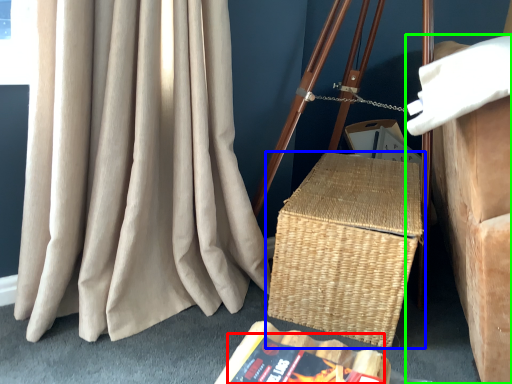
Question: Based on their relative distances, which object is nearer to paperback book (highlighted by a red box)? Choose from picnic basket (highlighted by a blue box) and furniture (highlighted by a green box).

Choices:
 (A) picnic basket
 (B) furniture

Answer: (A)